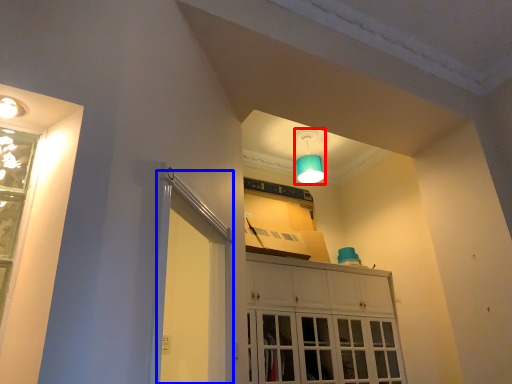
Question: Among these objects, which one is nearest to the camera, lamp (highlighted by a red box) or screen door (highlighted by a blue box)?

Choices:
 (A) lamp
 (B) screen door

Answer: (B)